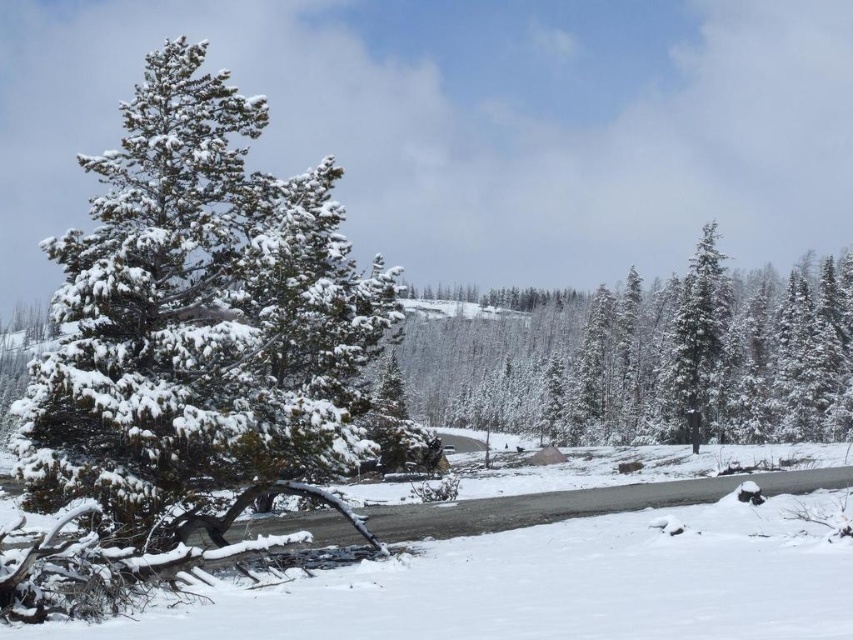
You are standing at the point marked by the coordinate point at [648,358] in the winter forest scene. Which object is directly in front of you?

The point at [648,358] marks the green textured pine tree at center, so the green textured pine tree at center is directly in front of you.